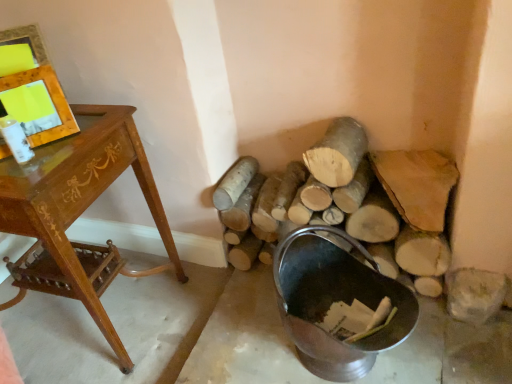
Question: Considering the positions of wooden desk at left and natural wood log at center, marked as the 1th log in a left-to-right arrangement, in the image, is wooden desk at left bigger or smaller than natural wood log at center, marked as the 1th log in a left-to-right arrangement,?

Choices:
 (A) big
 (B) small

Answer: (A)

Question: Looking at their shapes, would you say wooden desk at left is wider or thinner than natural wood log at center, positioned as the 2th log in right-to-left order?

Choices:
 (A) thin
 (B) wide

Answer: (B)

Question: Which object is the closest to the metallic bucket at lower right?

Choices:
 (A) natural wood log at center, marked as the 2th log in a left-to-right arrangement
 (B) wooden frame at upper left
 (C) wooden desk at left
 (D) natural wood log at center, marked as the 1th log in a left-to-right arrangement

Answer: (A)

Question: Based on their relative distances, which object is nearer to the metallic bucket at lower right?

Choices:
 (A) wooden frame at upper left
 (B) natural wood log at center, arranged as the 1th log when viewed from the right
 (C) wooden desk at left
 (D) natural wood log at center, marked as the 1th log in a left-to-right arrangement

Answer: (B)